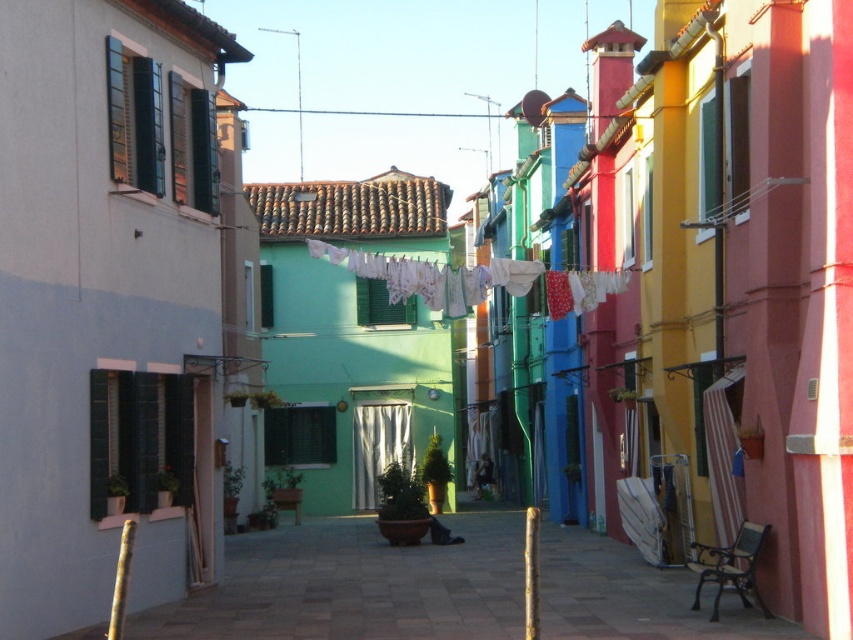
Question: Which point appears farthest from the camera in this image?

Choices:
 (A) (613, 285)
 (B) (462, 602)

Answer: (A)

Question: Which point is farther to the camera?

Choices:
 (A) white fabric clothesline at center
 (B) smooth concrete alley at center

Answer: (A)

Question: Which object appears closest to the camera in this image?

Choices:
 (A) white fabric clothesline at center
 (B) smooth concrete alley at center

Answer: (B)

Question: Is the position of smooth concrete alley at center more distant than that of white fabric clothesline at center?

Choices:
 (A) no
 (B) yes

Answer: (A)

Question: Does smooth concrete alley at center have a larger size compared to white fabric clothesline at center?

Choices:
 (A) yes
 (B) no

Answer: (A)

Question: Is smooth concrete alley at center further to camera compared to white fabric clothesline at center?

Choices:
 (A) yes
 (B) no

Answer: (B)